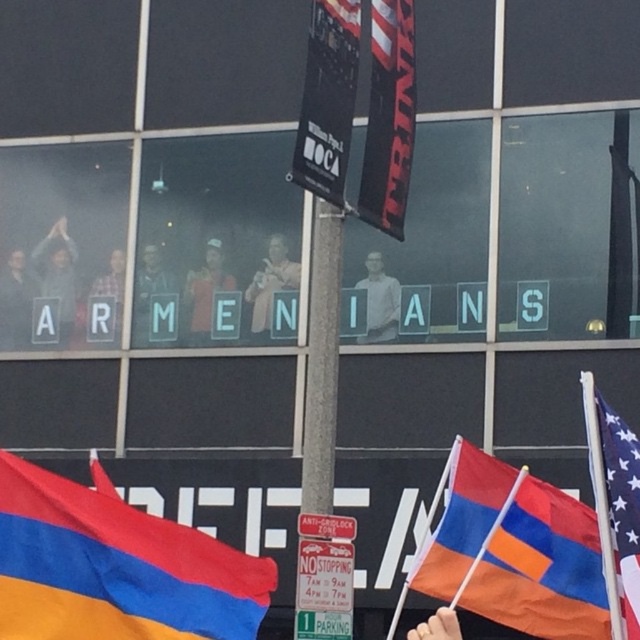
You are a photographer trying to capture a clear shot of the matte gray shirt at center and the matte black shirt at center. Which shirt should you focus on first if you want to ensure both are in frame without moving the camera?

You should focus on the matte gray shirt at center first because it is wider than the matte black shirt at center, ensuring it fits within the frame before adjusting for the narrower one.

You are a photographer trying to capture a clear shot of both the matte gray shirt at center and the matte black shirt at center in the scene. Based on their sizes in the image, which one would appear larger in your photo?

The matte gray shirt at center appears larger in the photo because it is much taller than the matte black shirt at center.

You are a photographer trying to capture a clear shot of both the red fabric flag at center and the matte black cap at center. Since you want the flags to look more prominent in the photo, which object should you focus on to ensure it appears wider in the frame?

The red fabric flag at center has a lesser width compared to matte black cap at center. To make the flags more prominent, focus on the matte black cap at center since it is wider and will appear more prominent in the photo.